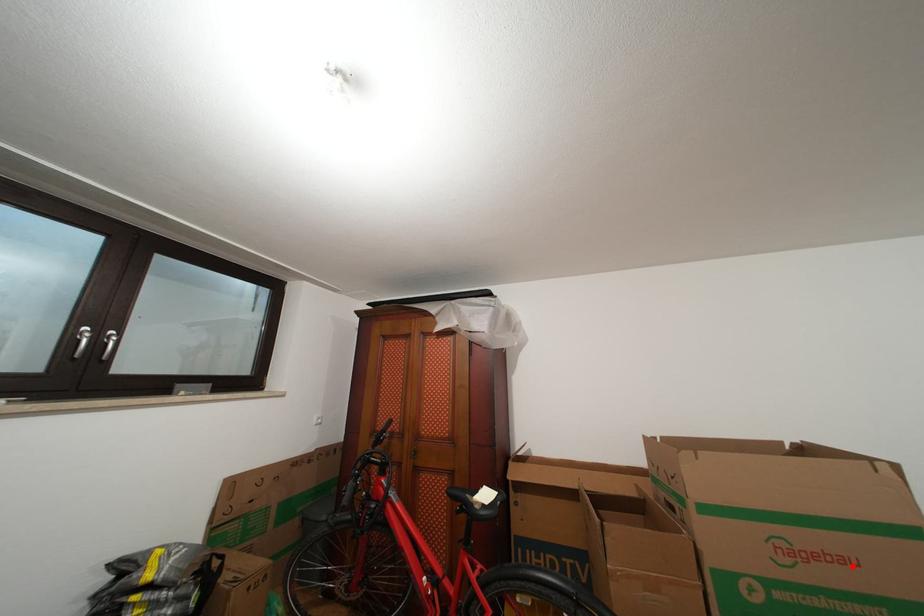
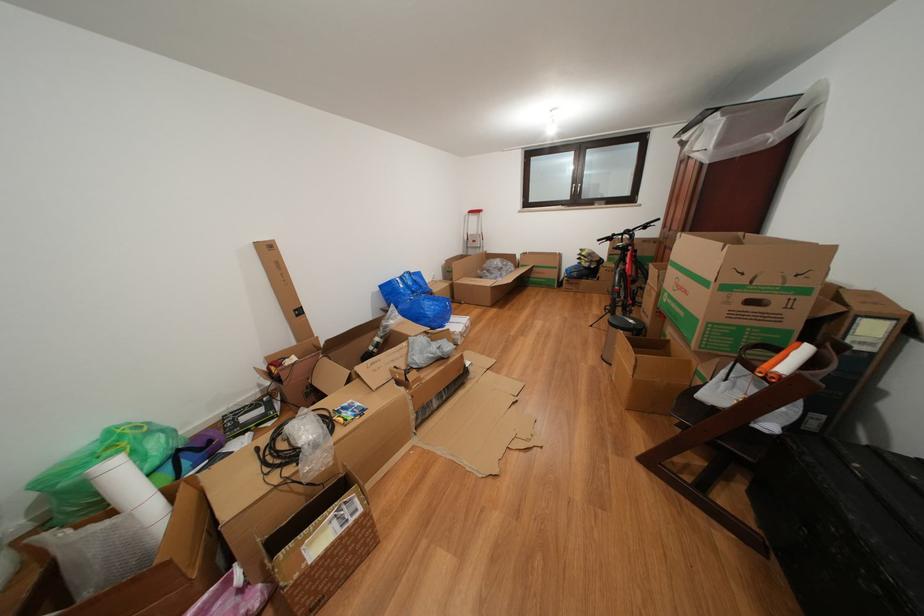
Question: I am providing you with two images of the same scene from different viewpoints. Given a red point in image1, look at the same physical point in image2. Is it:

Choices:
 (A) Closer to the viewpoint
 (B) Farther from the viewpoint

Answer: (B)